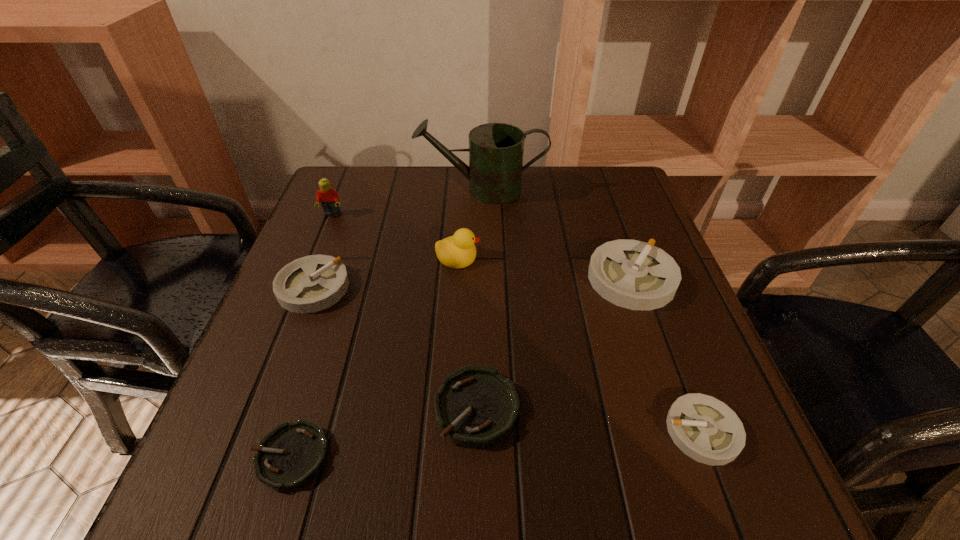
You are a GUI agent. You are given a task and a screenshot of the screen. Output one action in this format:
    pyautogui.click(x=<x>, y=<y>)
    Task: Click on the nearest gray ashtray
    Image resolution: width=960 pixels, height=540 pixels.
    Given the screenshot: What is the action you would take?
    pyautogui.click(x=704, y=428)

The image size is (960, 540). In order to click on the right green ashtray in this screenshot , I will do `click(477, 407)`.

Image resolution: width=960 pixels, height=540 pixels. Identify the location of the third ashtray from left to right. (477, 407).

The height and width of the screenshot is (540, 960). What are the coordinates of `the left green ashtray` in the screenshot? It's located at (292, 454).

Where is `the shortest ashtray`? The image size is (960, 540). the shortest ashtray is located at coordinates (292, 454).

You are a GUI agent. You are given a task and a screenshot of the screen. Output one action in this format:
    pyautogui.click(x=<x>, y=<y>)
    Task: Click on the blank space located 0.160m with the spout on the tallest object
    Image resolution: width=960 pixels, height=540 pixels.
    Given the screenshot: What is the action you would take?
    pyautogui.click(x=356, y=190)

Find the location of `vacant region located with the spout on the tallest object`. vacant region located with the spout on the tallest object is located at coordinates (333, 190).

The height and width of the screenshot is (540, 960). I want to click on free space located 0.230m with the spout on the tallest object, so click(x=330, y=190).

Locate an element on the screen. The width and height of the screenshot is (960, 540). vacant space located on the face of the second farthest object is located at coordinates (315, 257).

The width and height of the screenshot is (960, 540). I want to click on blank space located on the face of the sixth shortest object, so click(x=503, y=256).